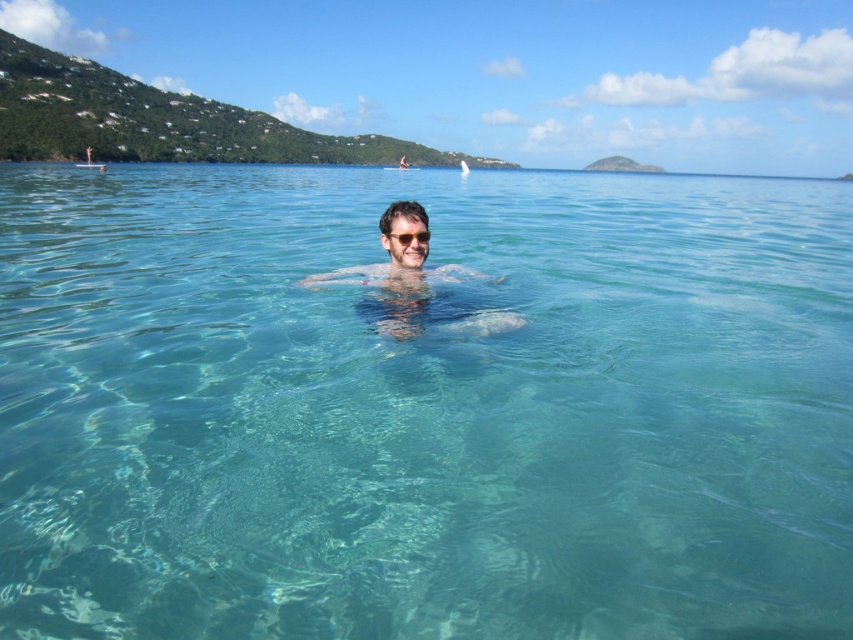
Question: Does matte skin at center have a smaller size compared to transparent plastic goggles at center?

Choices:
 (A) no
 (B) yes

Answer: (A)

Question: Among these objects, which one is farthest from the camera?

Choices:
 (A) matte skin at center
 (B) clear water at center

Answer: (A)

Question: Is clear water at center above matte skin at center?

Choices:
 (A) yes
 (B) no

Answer: (A)

Question: Does clear water at center have a lesser width compared to transparent plastic goggles at center?

Choices:
 (A) no
 (B) yes

Answer: (A)

Question: Which of the following is the farthest from the observer?

Choices:
 (A) (488, 332)
 (B) (103, 554)

Answer: (A)

Question: Among these objects, which one is nearest to the camera?

Choices:
 (A) transparent plastic goggles at center
 (B) clear water at center

Answer: (B)